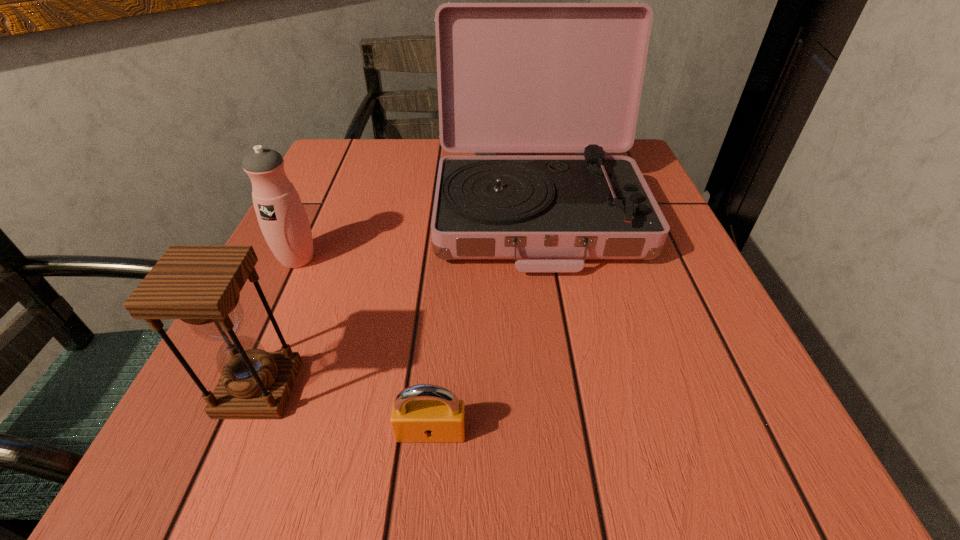
Where is `object that is the second nearest to the thermos bottle`? The height and width of the screenshot is (540, 960). object that is the second nearest to the thermos bottle is located at coordinates (512, 77).

Locate an element on the screen. This screenshot has width=960, height=540. the third closest object to the nearest object is located at coordinates (284, 223).